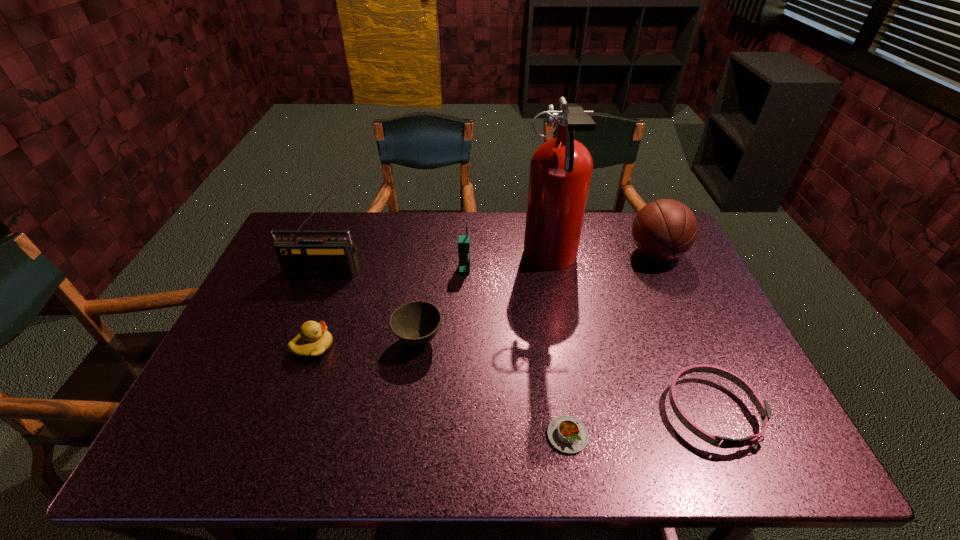
What are the coordinates of `basketball present at the right edge` in the screenshot? It's located at (664, 229).

Where is `dog collar that is positioned at the right edge`? The height and width of the screenshot is (540, 960). dog collar that is positioned at the right edge is located at coordinates (762, 406).

Where is `object located at the far right corner`? The image size is (960, 540). object located at the far right corner is located at coordinates (664, 229).

Identify the location of object positioned at the near right corner. This screenshot has width=960, height=540. (762, 406).

Image resolution: width=960 pixels, height=540 pixels. I want to click on vacant space at the far edge, so click(421, 225).

Where is `blank space at the near edge of the desktop`? This screenshot has height=540, width=960. blank space at the near edge of the desktop is located at coordinates (387, 429).

In the image, there is a desktop. Identify the location of blank space at the left edge. Image resolution: width=960 pixels, height=540 pixels. (268, 300).

Identify the location of free space at the right edge. This screenshot has height=540, width=960. (709, 416).

Locate an element on the screen. free space at the near left corner is located at coordinates (203, 461).

Locate an element on the screen. The height and width of the screenshot is (540, 960). free location at the near right corner is located at coordinates (771, 457).